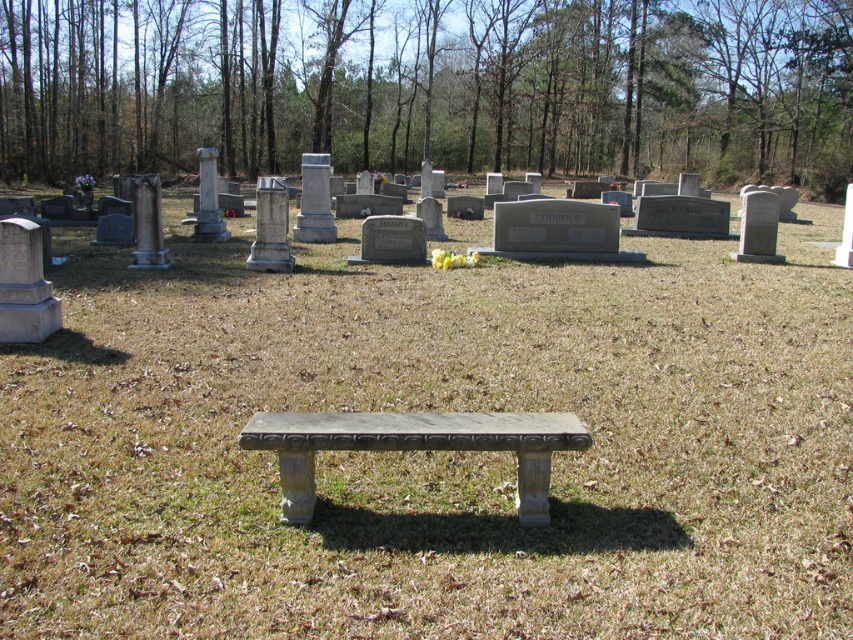
Locate an element on the screen. The image size is (853, 640). green leafy tree at upper center is located at coordinates (430, 86).

Identify the location of green leafy tree at upper center. This screenshot has height=640, width=853. (430, 86).

Locate an element on the screen. This screenshot has height=640, width=853. green leafy tree at upper center is located at coordinates (430, 86).

Can you confirm if green grass at center is positioned to the right of gray stone bench at center?

Incorrect, green grass at center is not on the right side of gray stone bench at center.

Is the position of green grass at center less distant than that of gray stone bench at center?

Yes.

Find the location of a particular element. The height and width of the screenshot is (640, 853). green grass at center is located at coordinates (434, 452).

Does green grass at center have a lesser height compared to green leafy tree at upper center?

Indeed, green grass at center has a lesser height compared to green leafy tree at upper center.

Which is in front, point (189, 627) or point (722, 141)?

Point (189, 627)

Does point (747, 266) come farther from viewer compared to point (780, 45)?

No.

What are the coordinates of `green grass at center` in the screenshot? It's located at (434, 452).